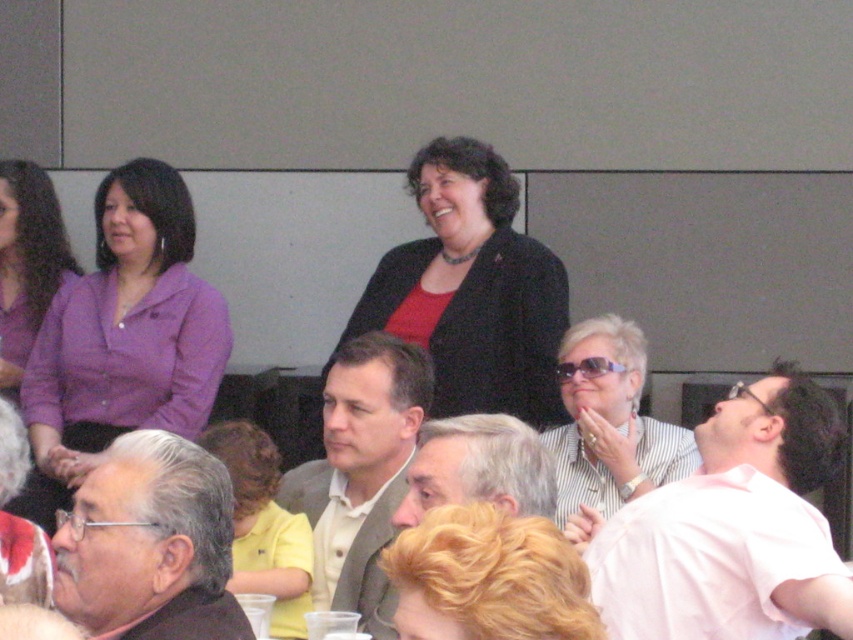
You are standing in the auditorium and see a person with gray hair at lower left. Where exactly is the gray hair located in terms of coordinates?

The gray hair at lower left is located at coordinates point (149, 545).

Please look at the image and identify the location of the point labeled as point [488,579]. Is it located at the center of the image or near the edge?

The point labeled as point [488,579] is located at the center of the image.